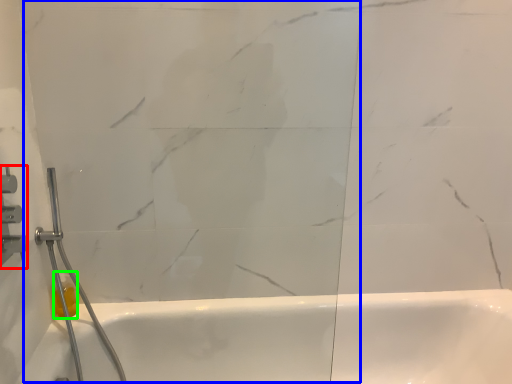
Question: Considering the real-world distances, which object is farthest from shower (highlighted by a red box)? glass door (highlighted by a blue box) or toiletry (highlighted by a green box)?

Choices:
 (A) glass door
 (B) toiletry

Answer: (A)